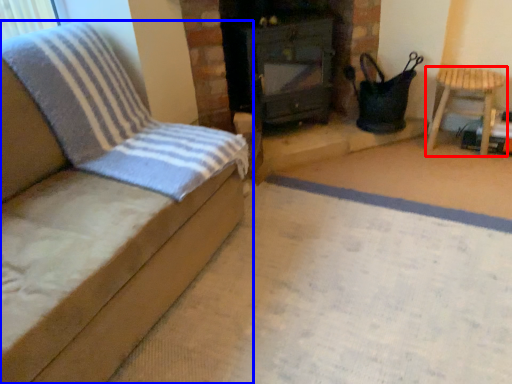
Question: Which object appears closest to the camera in this image, furniture (highlighted by a red box) or furniture (highlighted by a blue box)?

Choices:
 (A) furniture
 (B) furniture

Answer: (B)